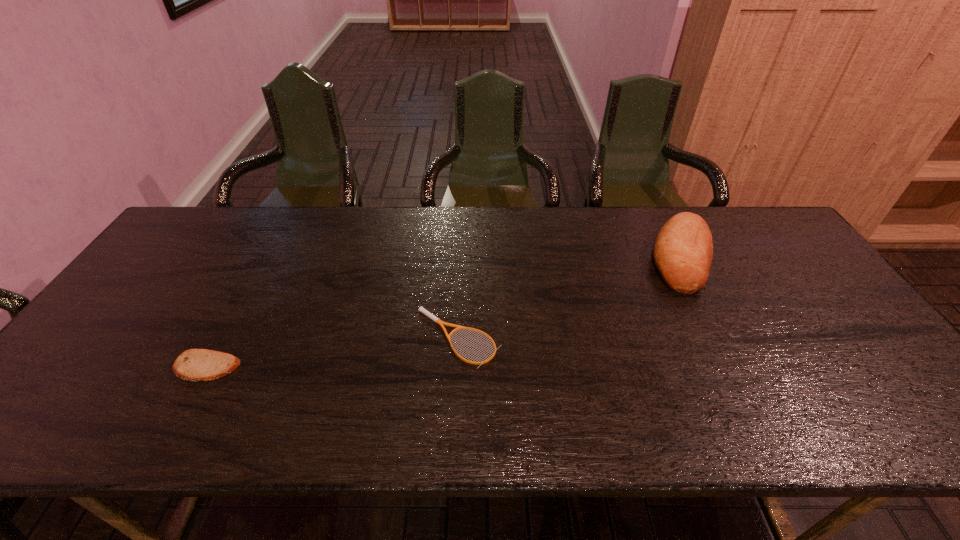
Where is `empty space that is in between the pita bread and the second object from left to right`? empty space that is in between the pita bread and the second object from left to right is located at coordinates (332, 353).

This screenshot has height=540, width=960. What are the coordinates of `empty space that is in between the pita bread and the second object from left to right` in the screenshot? It's located at (332, 353).

Image resolution: width=960 pixels, height=540 pixels. I want to click on blank region between the farthest object and the shortest object, so click(x=570, y=298).

The height and width of the screenshot is (540, 960). What are the coordinates of `vacant area between the farthest object and the leftmost object` in the screenshot? It's located at (444, 312).

Find the location of `free space between the rightmost object and the tennis racket`. free space between the rightmost object and the tennis racket is located at coordinates (570, 298).

Where is `blank region between the second object from right to left and the tallest object`? This screenshot has height=540, width=960. blank region between the second object from right to left and the tallest object is located at coordinates (570, 298).

At what (x,y) coordinates should I click in order to perform the action: click on object that is the second nearest to the rightmost object. Please return your answer as a coordinate pair (x, y). Looking at the image, I should click on (195, 365).

Where is `the closest object relative to the pita bread`? the closest object relative to the pita bread is located at coordinates (421, 309).

Where is `free spot that satisfies the following two spatial constraints: 1. on the back side of the second shortest object; 2. on the right side of the second object from left to right`? The image size is (960, 540). free spot that satisfies the following two spatial constraints: 1. on the back side of the second shortest object; 2. on the right side of the second object from left to right is located at coordinates (222, 338).

In order to click on vacant point that satisfies the following two spatial constraints: 1. on the back side of the pita bread; 2. on the right side of the shortest object in this screenshot , I will do `click(222, 338)`.